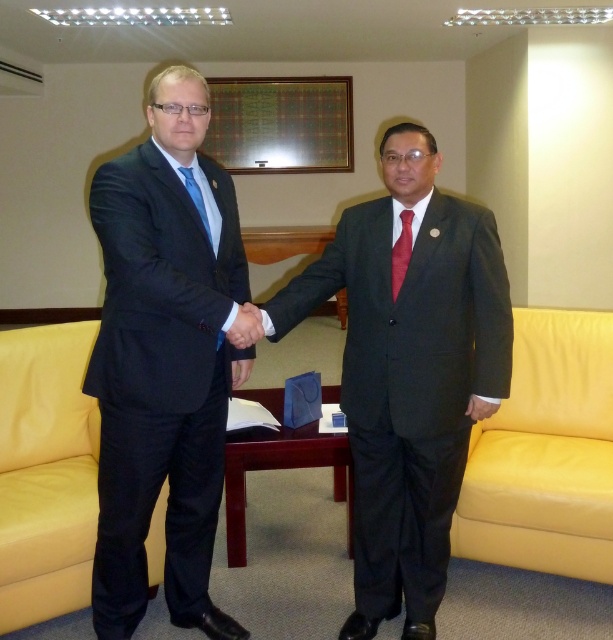
Question: Is dark gray suit at center positioned at the back of yellow leather couch at right?

Choices:
 (A) no
 (B) yes

Answer: (A)

Question: Can you confirm if yellow leather couch at right is positioned to the left of shiny red tie at center?

Choices:
 (A) no
 (B) yes

Answer: (A)

Question: Considering the real-world distances, which object is closest to the shiny red tie at center?

Choices:
 (A) matte black hand at center
 (B) dark gray suit at center
 (C) yellow leather couch at right

Answer: (B)

Question: Which of the following is the farthest from the observer?

Choices:
 (A) yellow leather couch at right
 (B) dark gray suit at center
 (C) matte blue tie at left

Answer: (A)

Question: Where is yellow leather couch at right located in relation to matte blue tie at left in the image?

Choices:
 (A) above
 (B) below

Answer: (B)

Question: Considering the real-world distances, which object is closest to the shiny red tie at center?

Choices:
 (A) dark gray suit at center
 (B) yellow leather couch at right
 (C) matte blue tie at left
 (D) matte black hand at center

Answer: (A)